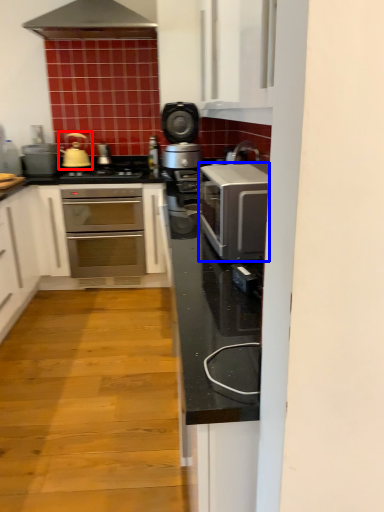
Question: Which object appears closest to the camera in this image, tea pot (highlighted by a red box) or kitchen appliance (highlighted by a blue box)?

Choices:
 (A) tea pot
 (B) kitchen appliance

Answer: (B)